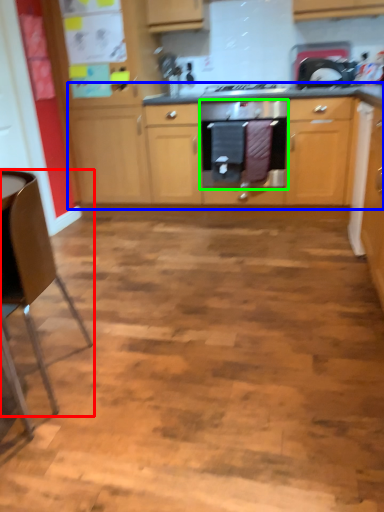
Question: Considering the real-world distances, which object is closest to chair (highlighted by a red box)? cabinetry (highlighted by a blue box) or home appliance (highlighted by a green box).

Choices:
 (A) cabinetry
 (B) home appliance

Answer: (B)